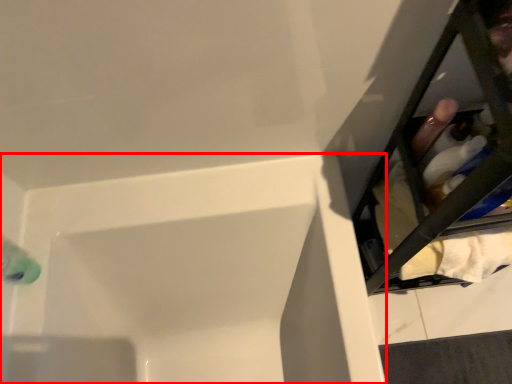
Question: From the image, what is the correct spatial relationship of bathtub (annotated by the red box) in relation to furniture?

Choices:
 (A) left
 (B) right

Answer: (A)